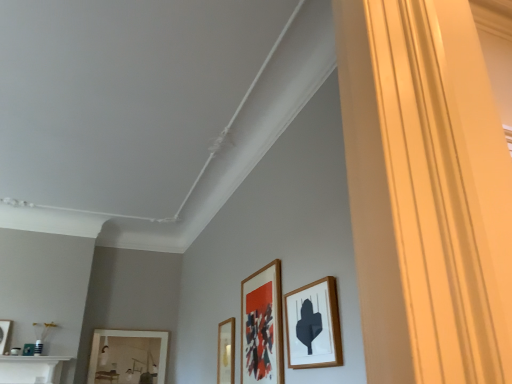
Question: Is the position of wooden picture frame at right, the first picture frame viewed from the right, less distant than that of wooden picture frame at lower center, positioned as the 3th picture frame in back-to-front order?

Choices:
 (A) yes
 (B) no

Answer: (A)

Question: Is wooden picture frame at right, which ranks as the first picture frame in front-to-back order, positioned with its back to wooden picture frame at lower center, acting as the 3th picture frame starting from the front?

Choices:
 (A) no
 (B) yes

Answer: (A)

Question: Is wooden picture frame at right, the 5th picture frame viewed from the left, placed right next to wooden picture frame at lower center, positioned as the 3th picture frame in back-to-front order?

Choices:
 (A) no
 (B) yes

Answer: (A)

Question: Considering the relative sizes of wooden picture frame at right, the 5th picture frame viewed from the left, and wooden picture frame at lower center, acting as the 3th picture frame starting from the front, in the image provided, is wooden picture frame at right, the 5th picture frame viewed from the left, thinner than wooden picture frame at lower center, acting as the 3th picture frame starting from the front,?

Choices:
 (A) yes
 (B) no

Answer: (B)

Question: Can you confirm if wooden picture frame at right, which is the fifth picture frame in back-to-front order, is bigger than wooden picture frame at lower center, acting as the 3th picture frame starting from the front?

Choices:
 (A) yes
 (B) no

Answer: (A)

Question: From the image's perspective, is wooden picture frame at right, which ranks as the first picture frame in front-to-back order, on top of wooden picture frame at lower center, acting as the 3th picture frame starting from the front?

Choices:
 (A) no
 (B) yes

Answer: (B)

Question: From a real-world perspective, is wooden picture frame at lower center, acting as the 3th picture frame starting from the front, located higher than wooden picture frame at right, the 5th picture frame viewed from the left?

Choices:
 (A) yes
 (B) no

Answer: (B)

Question: Considering the relative positions of wooden picture frame at lower center, positioned as the third picture frame in left-to-right order, and wooden picture frame at right, the 5th picture frame viewed from the left, in the image provided, is wooden picture frame at lower center, positioned as the third picture frame in left-to-right order, in front of wooden picture frame at right, the 5th picture frame viewed from the left,?

Choices:
 (A) yes
 (B) no

Answer: (B)

Question: Does wooden picture frame at lower center, acting as the 3th picture frame starting from the front, have a smaller size compared to wooden picture frame at right, the first picture frame viewed from the right?

Choices:
 (A) yes
 (B) no

Answer: (A)

Question: From the image's perspective, does wooden picture frame at lower center, which is the 3th picture frame from right to left, appear lower than wooden picture frame at right, which ranks as the first picture frame in front-to-back order?

Choices:
 (A) no
 (B) yes

Answer: (B)

Question: Is wooden picture frame at right, the 5th picture frame viewed from the left, a part of wooden picture frame at lower center, acting as the 3th picture frame starting from the front?

Choices:
 (A) no
 (B) yes

Answer: (A)

Question: Does wooden picture frame at lower center, positioned as the 3th picture frame in back-to-front order, turn towards wooden picture frame at right, the first picture frame viewed from the right?

Choices:
 (A) no
 (B) yes

Answer: (A)

Question: Does matte white picture frame at lower left, which appears as the first picture frame when viewed from the left, have a smaller size compared to matte wooden picture frame at center, the 4th picture frame positioned from the left?

Choices:
 (A) yes
 (B) no

Answer: (A)